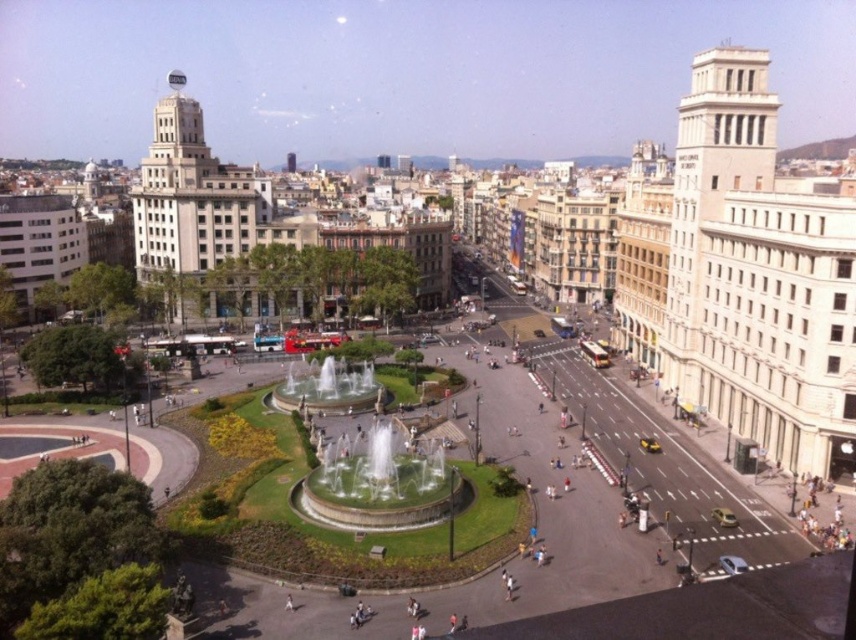
Based on the photo, you are a city planner assessing the central square. You notice the white marble fountain at center and the polished stone fountain at center. Which fountain has a greater width?

The white marble fountain at center has a greater width than the polished stone fountain at center.

You are standing in the city square and want to take a photo of the white marble fountain at center and the polished stone fountain at center. Which one appears closer to you in the photo?

The white marble fountain at center appears closer because it is in front of the polished stone fountain at center.